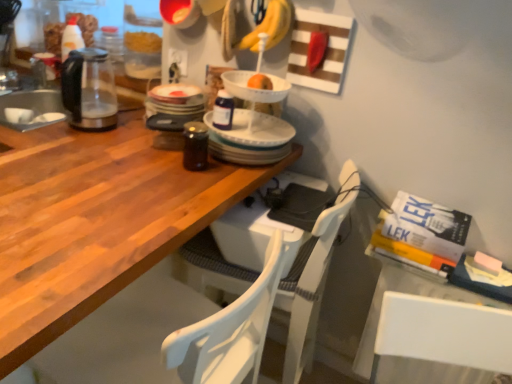
At what (x,y) coordinates should I click in order to perform the action: click on free point above wooden table at center (from a real-world perspective). Please return your answer as a coordinate pair (x, y). This screenshot has width=512, height=384. Looking at the image, I should click on (112, 187).